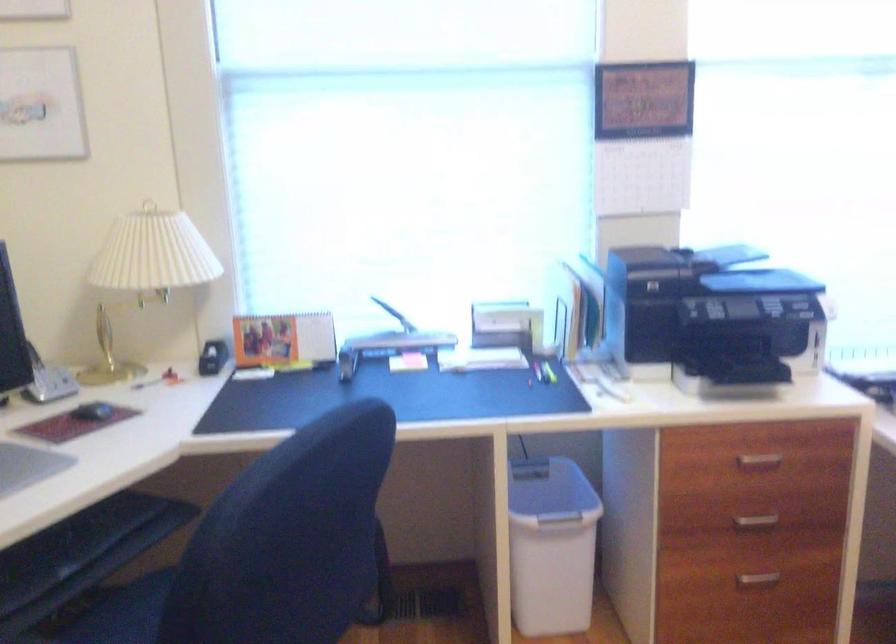
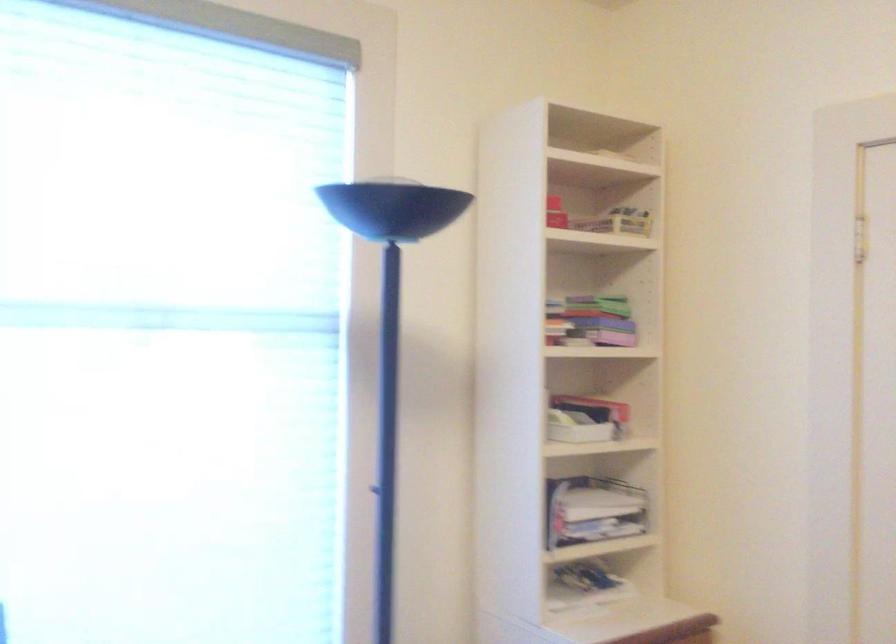
Question: Based on the continuous images, in which direction is the camera rotating? Reply with the corresponding letter.

Choices:
 (A) Left
 (B) Right
 (C) Up
 (D) Down

Answer: (B)